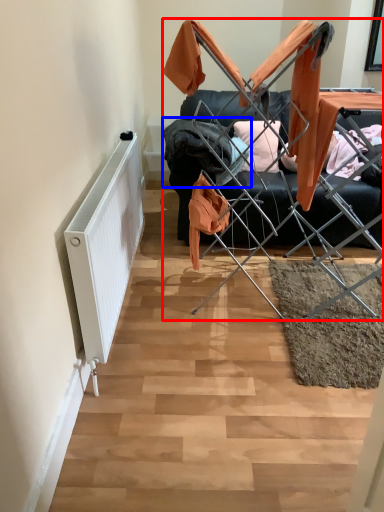
Question: Which of the following is the closest to the observer, furniture (highlighted by a red box) or clothing (highlighted by a blue box)?

Choices:
 (A) furniture
 (B) clothing

Answer: (A)